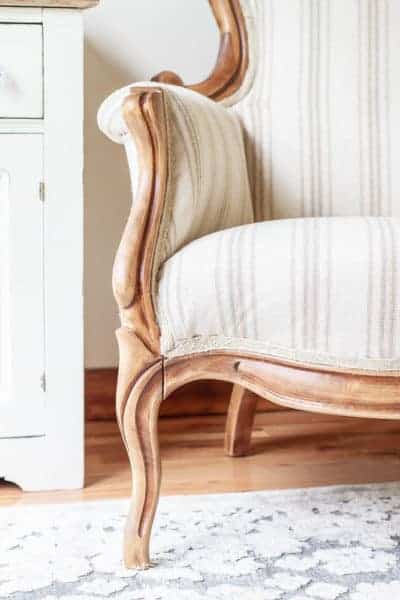
I want to click on back of chair, so click(x=360, y=30).